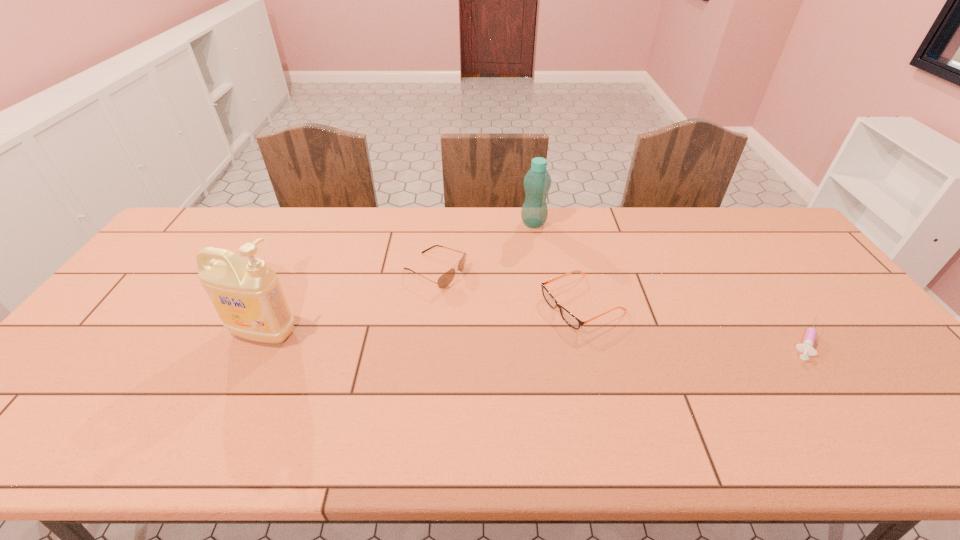
This screenshot has width=960, height=540. I want to click on free area in between the sunglasses and the farthest object, so click(484, 247).

Identify the location of unoccupied position between the water bottle and the third tallest object. Image resolution: width=960 pixels, height=540 pixels. (484, 247).

Locate an element on the screen. The width and height of the screenshot is (960, 540). vacant space in between the detergent and the farthest object is located at coordinates (398, 278).

The image size is (960, 540). I want to click on vacant area that lies between the detergent and the spectacles, so click(423, 318).

Where is `vacant area that lies between the leftmost object and the fourth object from right to left`? The height and width of the screenshot is (540, 960). vacant area that lies between the leftmost object and the fourth object from right to left is located at coordinates (349, 302).

I want to click on free space between the shortest object and the sunglasses, so [x=621, y=306].

Identify which object is the fourth nearest to the rightmost object. Please provide its 2D coordinates. Your answer should be formatted as a tuple, i.e. [(x, y)], where the tuple contains the x and y coordinates of a point satisfying the conditions above.

[(247, 295)]

Select which object is the fourth closest to the syringe. Please provide its 2D coordinates. Your answer should be formatted as a tuple, i.e. [(x, y)], where the tuple contains the x and y coordinates of a point satisfying the conditions above.

[(247, 295)]

Identify the location of free spot that satisfies the following two spatial constraints: 1. on the front side of the fourth shortest object; 2. on the left side of the spectacles. (546, 303).

At what (x,y) coordinates should I click in order to perform the action: click on vacant position in the image that satisfies the following two spatial constraints: 1. on the front side of the rightmost object; 2. on the right side of the leftmost object. Please return your answer as a coordinate pair (x, y). The width and height of the screenshot is (960, 540). Looking at the image, I should click on (260, 340).